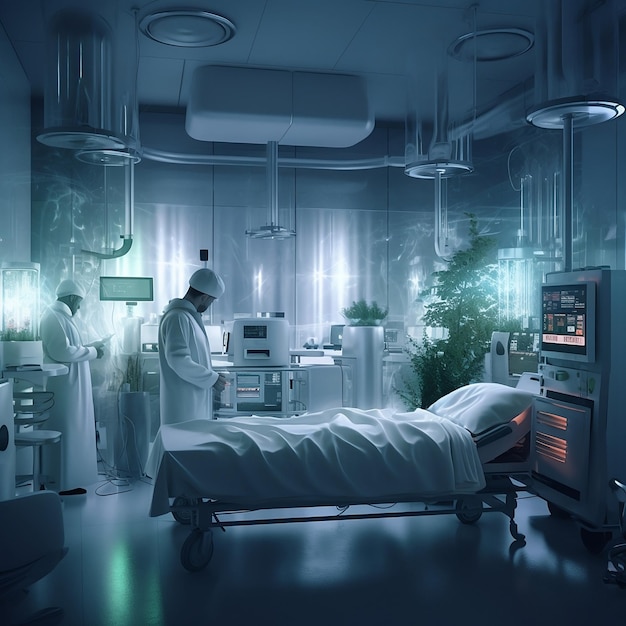
Where is `floor`? This screenshot has width=626, height=626. floor is located at coordinates (134, 578).